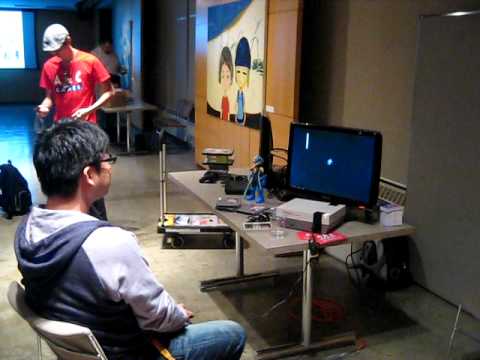
Where is `screens`? The width and height of the screenshot is (480, 360). screens is located at coordinates (366, 194), (13, 43).